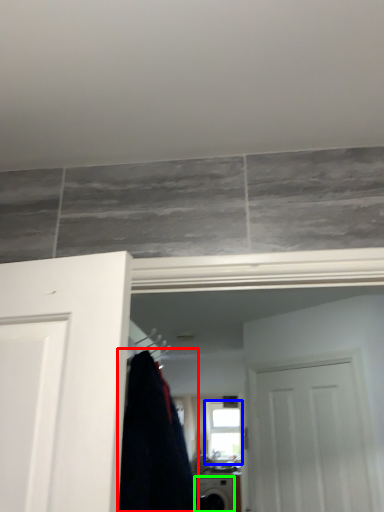
Question: Based on their relative distances, which object is nearer to clothing (highlighted by a red box)? Choose from window (highlighted by a blue box) and appliance (highlighted by a green box).

Choices:
 (A) window
 (B) appliance

Answer: (B)